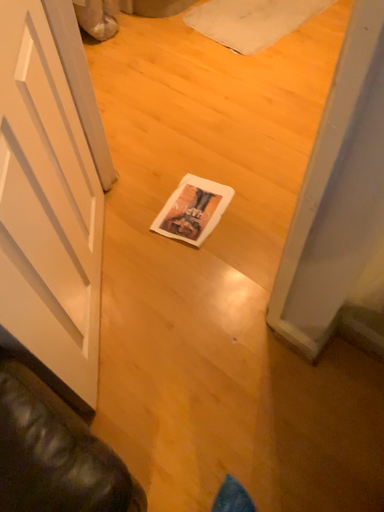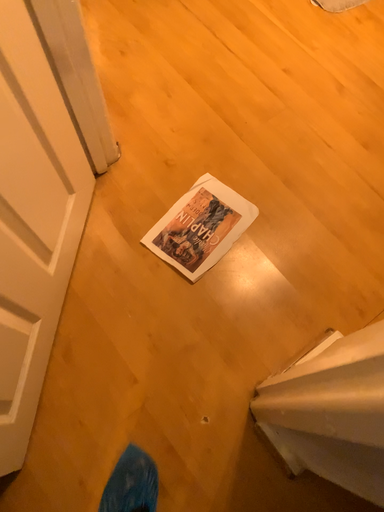
Question: Which way did the camera rotate in the video?

Choices:
 (A) rotated downward
 (B) rotated upward

Answer: (A)